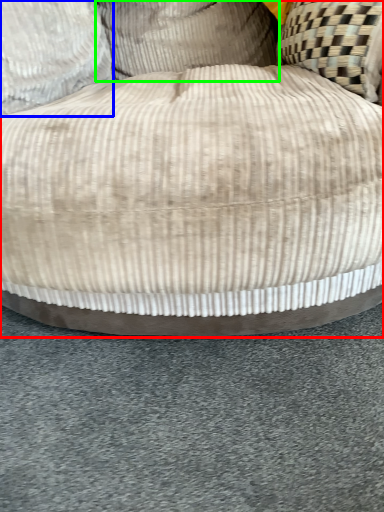
Question: Which is nearer to the furniture (highlighted by a red box)? pillow (highlighted by a blue box) or pillow (highlighted by a green box).

Choices:
 (A) pillow
 (B) pillow

Answer: (A)